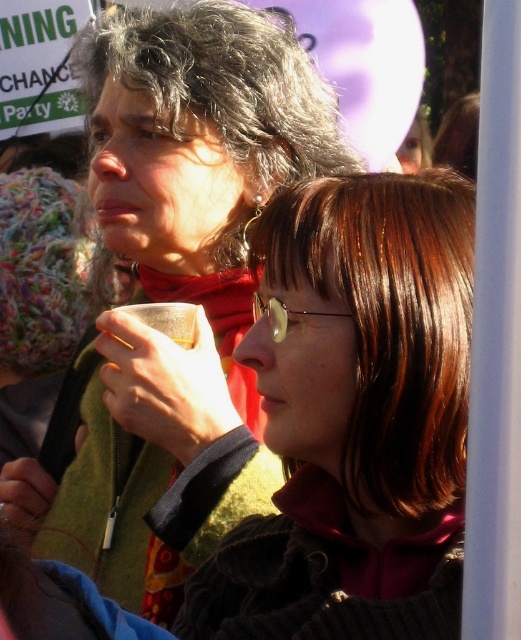
Question: Which point is farther to the camera?

Choices:
 (A) (389, 472)
 (B) (114, 244)

Answer: (B)

Question: Which object appears closest to the camera in this image?

Choices:
 (A) brown hair at center
 (B) matte black jacket at upper center

Answer: (A)

Question: Is matte black jacket at upper center thinner than brown hair at center?

Choices:
 (A) yes
 (B) no

Answer: (B)

Question: Considering the relative positions of matte black jacket at upper center and brown hair at center in the image provided, where is matte black jacket at upper center located with respect to brown hair at center?

Choices:
 (A) below
 (B) above

Answer: (B)

Question: Where is matte black jacket at upper center located in relation to brown hair at center in the image?

Choices:
 (A) below
 (B) above

Answer: (B)